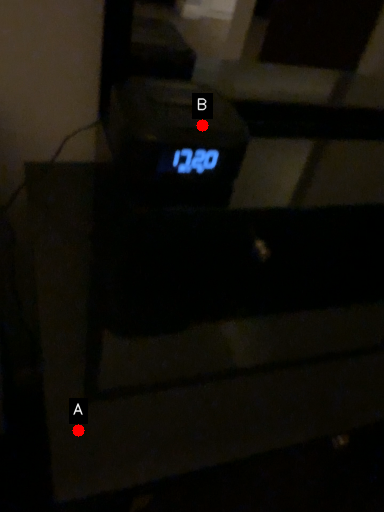
Question: Two points are circled on the image, labeled by A and B beside each circle. Which point is closer to the camera taking this photo?

Choices:
 (A) A is closer
 (B) B is closer

Answer: (B)